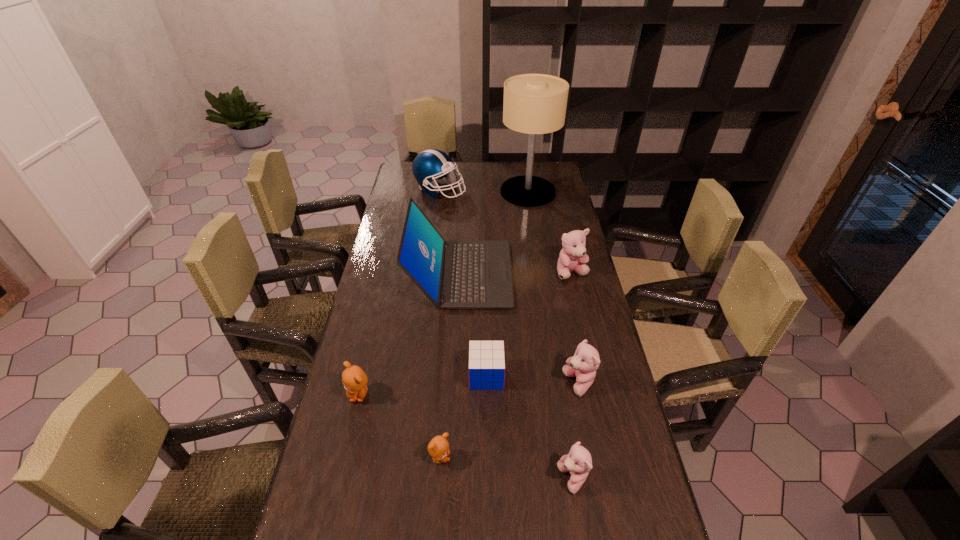
Identify the location of teddy bear that is the third closest to the farthest pink teddy bear. (438, 447).

Point out which pink teddy bear is positioned as the nearest to the second biggest pink teddy bear. Please provide its 2D coordinates. Your answer should be formatted as a tuple, i.e. [(x, y)], where the tuple contains the x and y coordinates of a point satisfying the conditions above.

[(578, 462)]

Locate an element on the screen. the closest pink teddy bear to the nearest pink teddy bear is located at coordinates (583, 365).

Find the location of a particular element. Image resolution: width=960 pixels, height=540 pixels. blank space that satisfies the following two spatial constraints: 1. at the front of the table lamp with the faceguard; 2. on the right side of the football helmet is located at coordinates (440, 192).